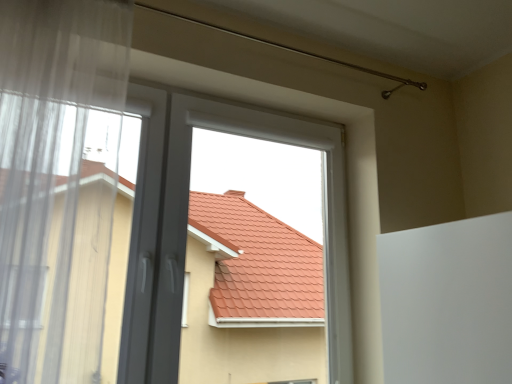
In order to click on transparent fabric at left in this screenshot , I will do `click(55, 183)`.

What do you see at coordinates (55, 183) in the screenshot? The width and height of the screenshot is (512, 384). I see `transparent fabric at left` at bounding box center [55, 183].

What is the approximate width of white plastic window at center?

5.88 inches.

What is the approximate height of white plastic window at center?

white plastic window at center is 3.92 feet in height.

This screenshot has width=512, height=384. Find the location of `white plastic window at center`. white plastic window at center is located at coordinates (188, 212).

Describe the element at coordinates (188, 212) in the screenshot. The height and width of the screenshot is (384, 512). I see `white plastic window at center` at that location.

You are a GUI agent. You are given a task and a screenshot of the screen. Output one action in this format:
    pyautogui.click(x=<x>, y=<y>)
    Task: Click on the transparent fabric at left
    
    Given the screenshot: What is the action you would take?
    pyautogui.click(x=55, y=183)

Considering the positions of objects white plastic window at center and transparent fabric at left in the image provided, who is more to the left, white plastic window at center or transparent fabric at left?

Positioned to the left is transparent fabric at left.

Which is in front, white plastic window at center or transparent fabric at left?

Positioned in front is transparent fabric at left.

Does point (165, 307) lie in front of point (75, 62)?

No.

From the image's perspective, is white plastic window at center located above or below transparent fabric at left?

white plastic window at center is below transparent fabric at left.

From a real-world perspective, between white plastic window at center and transparent fabric at left, who is vertically higher?

transparent fabric at left is physically above.

Considering the relative sizes of white plastic window at center and transparent fabric at left in the image provided, is white plastic window at center wider than transparent fabric at left?

Incorrect, the width of white plastic window at center does not surpass that of transparent fabric at left.

Can you confirm if white plastic window at center is taller than transparent fabric at left?

In fact, white plastic window at center may be shorter than transparent fabric at left.

Looking at this image, who is bigger, white plastic window at center or transparent fabric at left?

white plastic window at center.

From the picture: Would you say white plastic window at center is inside or outside transparent fabric at left?

The correct answer is: outside.

Is white plastic window at center far from transparent fabric at left?

No, white plastic window at center is in close proximity to transparent fabric at left.

Is white plastic window at center oriented away from transparent fabric at left?

No, white plastic window at center's orientation is not away from transparent fabric at left.

Can you tell me how much white plastic window at center and transparent fabric at left differ in facing direction?

There is a 0.964-degree angle between the facing directions of white plastic window at center and transparent fabric at left.

Identify the location of window that is above the white plastic window at center (from a real-world perspective). This screenshot has height=384, width=512. (55, 183).

Between transparent fabric at left and white plastic window at center, which one appears on the left side from the viewer's perspective?

From the viewer's perspective, transparent fabric at left appears more on the left side.

Is transparent fabric at left in front of or behind white plastic window at center in the image?

transparent fabric at left is in front of white plastic window at center.

Does point (80, 20) appear closer or farther from the camera than point (261, 132)?

Point (80, 20).

From the image's perspective, which is above, transparent fabric at left or white plastic window at center?

transparent fabric at left.

In the scene shown: From a real-world perspective, is transparent fabric at left above or below white plastic window at center?

transparent fabric at left is situated higher than white plastic window at center in the real world.

Considering the sizes of objects transparent fabric at left and white plastic window at center in the image provided, who is thinner, transparent fabric at left or white plastic window at center?

Thinner between the two is white plastic window at center.

In terms of height, does transparent fabric at left look taller or shorter compared to white plastic window at center?

transparent fabric at left is taller than white plastic window at center.

Which of these two, transparent fabric at left or white plastic window at center, is smaller?

transparent fabric at left is smaller.

Is transparent fabric at left completely or partially outside of white plastic window at center?

transparent fabric at left is positioned outside white plastic window at center.

Is there a large distance between transparent fabric at left and white plastic window at center?

Actually, transparent fabric at left and white plastic window at center are a little close together.

Is transparent fabric at left positioned with its back to white plastic window at center?

No, transparent fabric at left is not facing away from white plastic window at center.

You are a GUI agent. You are given a task and a screenshot of the screen. Output one action in this format:
    pyautogui.click(x=<x>, y=<y>)
    Task: Click on the window in front of the white plastic window at center
    This screenshot has height=384, width=512.
    Given the screenshot: What is the action you would take?
    pyautogui.click(x=55, y=183)

The width and height of the screenshot is (512, 384). I want to click on window above the white plastic window at center (from the image's perspective), so click(x=55, y=183).

Locate an element on the screen. This screenshot has width=512, height=384. window located on the left of white plastic window at center is located at coordinates click(55, 183).